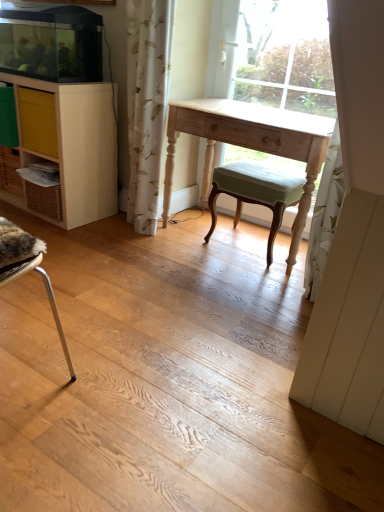
Question: From the image's perspective, is light wood desk at center positioned above or below light wood desk at center?

Choices:
 (A) below
 (B) above

Answer: (B)

Question: In the image, is light wood desk at center on the left side or the right side of light wood desk at center?

Choices:
 (A) right
 (B) left

Answer: (A)

Question: Estimate the real-world distances between objects in this image. Which object is closer to the light green fabric stool at center?

Choices:
 (A) yellow matte drawer at left
 (B) white floral fabric curtain at center
 (C) light wood cabinet at left
 (D) light wood desk at center
 (E) light wood desk at center

Answer: (E)

Question: Estimate the real-world distances between objects in this image. Which object is closer to the light wood desk at center?

Choices:
 (A) yellow matte drawer at left
 (B) light green fabric stool at center
 (C) white floral fabric curtain at center
 (D) light wood cabinet at left
 (E) light wood desk at center

Answer: (B)